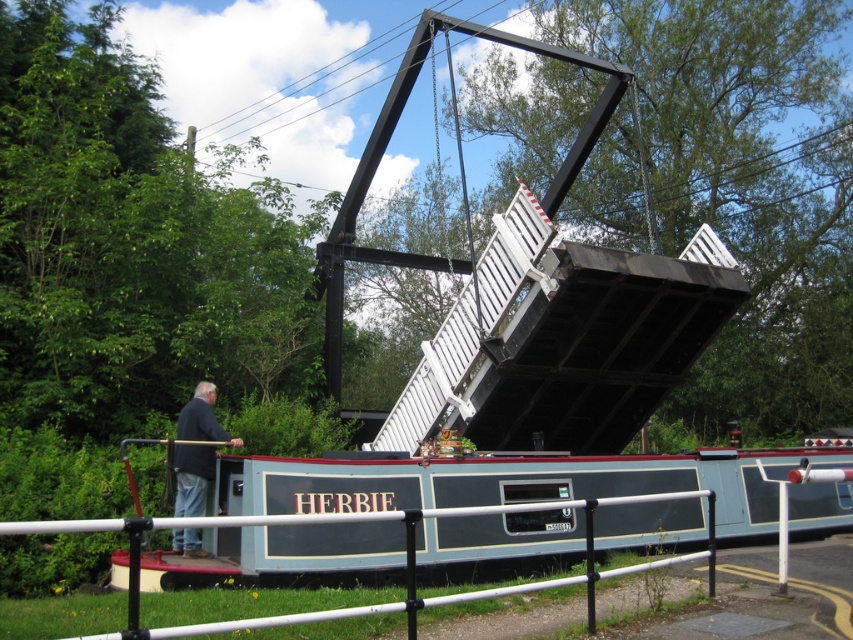
Question: Does white metal rail at lower center have a greater width compared to dark blue jacket at lower left?

Choices:
 (A) no
 (B) yes

Answer: (A)

Question: Can you confirm if white metal rail at lower center is smaller than dark blue jacket at lower left?

Choices:
 (A) yes
 (B) no

Answer: (A)

Question: Which point is closer to the camera taking this photo?

Choices:
 (A) (207, 417)
 (B) (347, 609)

Answer: (B)

Question: Is white metal rail at lower center bigger than dark blue jacket at lower left?

Choices:
 (A) no
 (B) yes

Answer: (A)